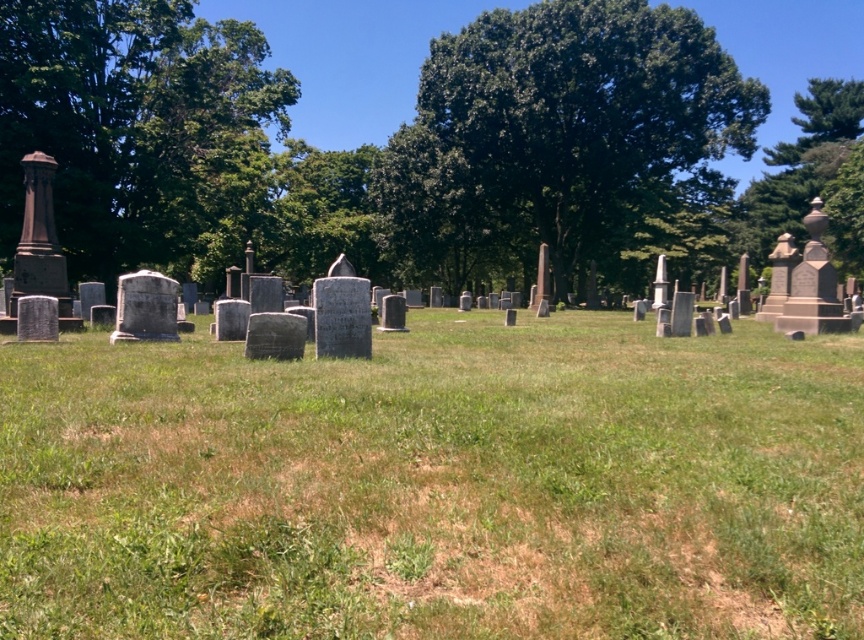
Question: Does green grassy field at center have a smaller size compared to green leafy tree at center?

Choices:
 (A) no
 (B) yes

Answer: (B)

Question: Observing the image, what is the correct spatial positioning of green grassy field at center in reference to green leafy tree at upper right?

Choices:
 (A) left
 (B) right

Answer: (A)

Question: From the image, what is the correct spatial relationship of green grassy field at center in relation to green leafy tree at center?

Choices:
 (A) above
 (B) below

Answer: (B)

Question: Which point is farther to the camera?

Choices:
 (A) (455, 280)
 (B) (67, 572)

Answer: (A)

Question: Which of the following is the closest to the observer?

Choices:
 (A) green leafy tree at center
 (B) green grassy field at center
 (C) green leafy tree at upper right

Answer: (B)

Question: Which point is closer to the camera?

Choices:
 (A) green leafy tree at center
 (B) green grassy field at center
 (C) green leafy tree at upper right

Answer: (B)